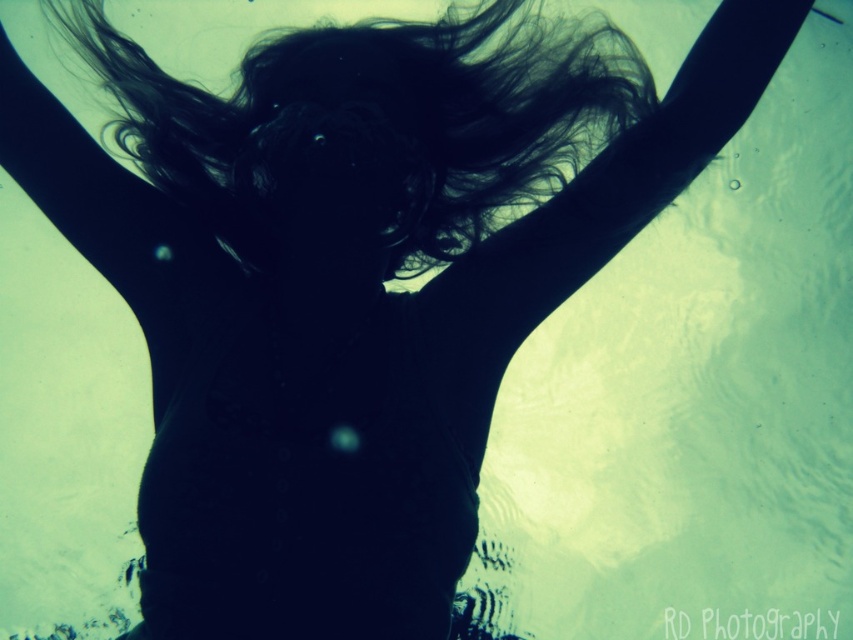
Question: From the image, what is the correct spatial relationship of black silky hair at center in relation to black matte hair at upper center?

Choices:
 (A) above
 (B) below

Answer: (A)

Question: Can you confirm if black silky hair at center is smaller than black matte hair at upper center?

Choices:
 (A) no
 (B) yes

Answer: (A)

Question: Which of the following is the farthest from the observer?

Choices:
 (A) black silky hair at center
 (B) black matte hair at upper center

Answer: (A)

Question: Can you confirm if black silky hair at center is smaller than black matte hair at upper center?

Choices:
 (A) no
 (B) yes

Answer: (A)